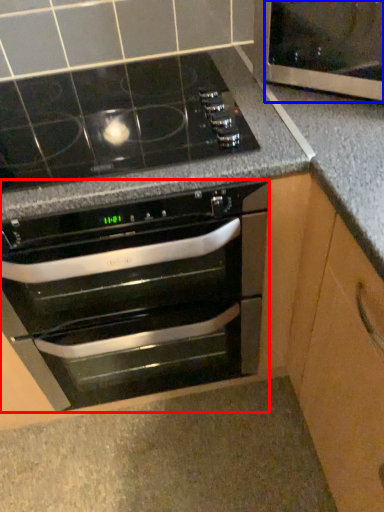
Question: Which object is closer to the camera taking this photo, oven (highlighted by a red box) or glass door (highlighted by a blue box)?

Choices:
 (A) oven
 (B) glass door

Answer: (A)